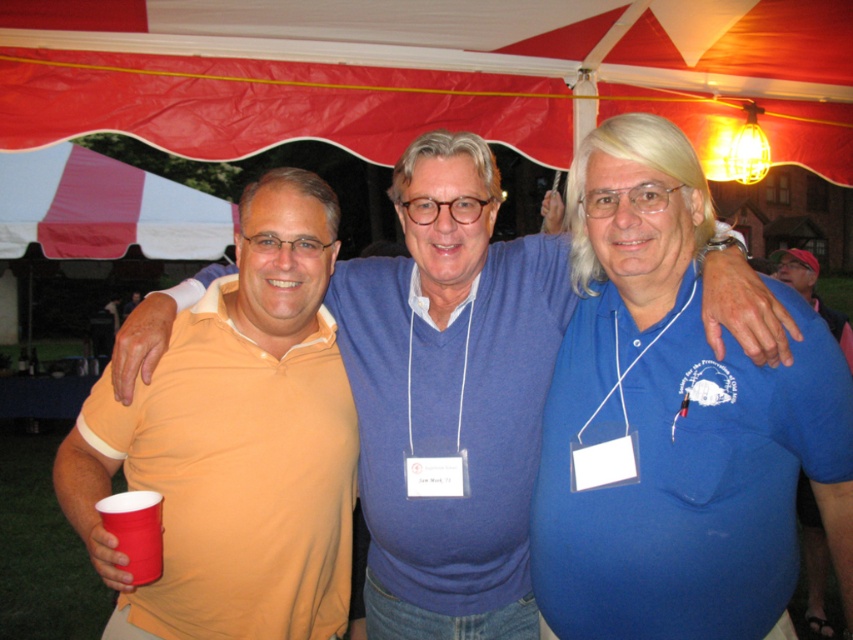
You are a photographer at the event and want to take a photo of the blue cotton shirt at center and the orange matte polo shirt at center. According to the spatial arrangement, which one is positioned higher?

The blue cotton shirt at center is located above the orange matte polo shirt at center, so it is positioned higher.

You are at an outdoor event and see two people wearing orange polo shirts. The one on the left is wearing an orange cotton polo shirt at left, and the one in the center is wearing an orange matte polo shirt at center. Which orange polo shirt is positioned more to the left?

The orange cotton polo shirt at left is positioned more to the left than the orange matte polo shirt at center.

You are a photographer at an outdoor event. You need to capture a photo of the orange matte polo shirt at center and the red plastic cup at lower left. Based on their positions, will the cup be visible in the frame if you focus on the shirt?

The orange matte polo shirt at center is located above the red plastic cup at lower left, so if you focus on the shirt, the cup should still be visible in the lower part of the frame.